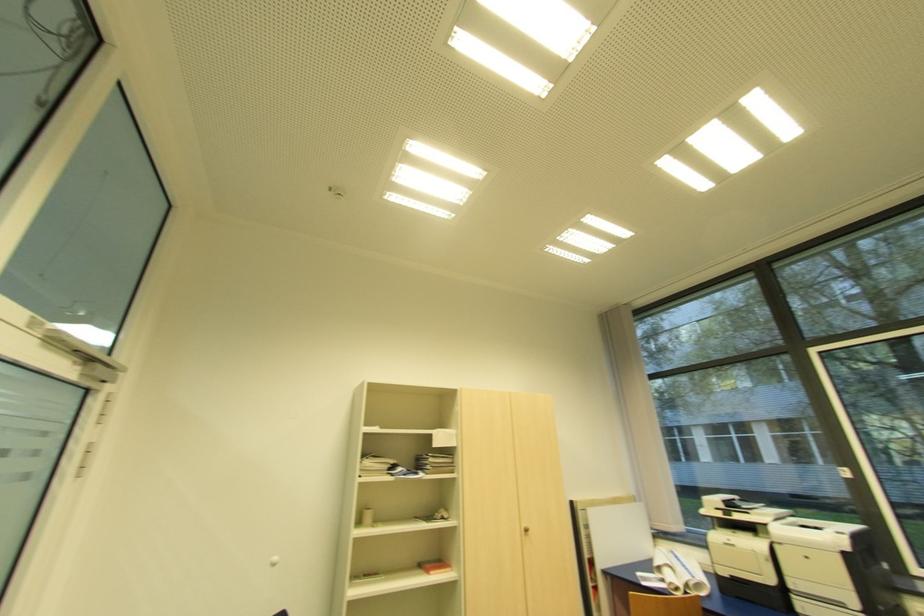
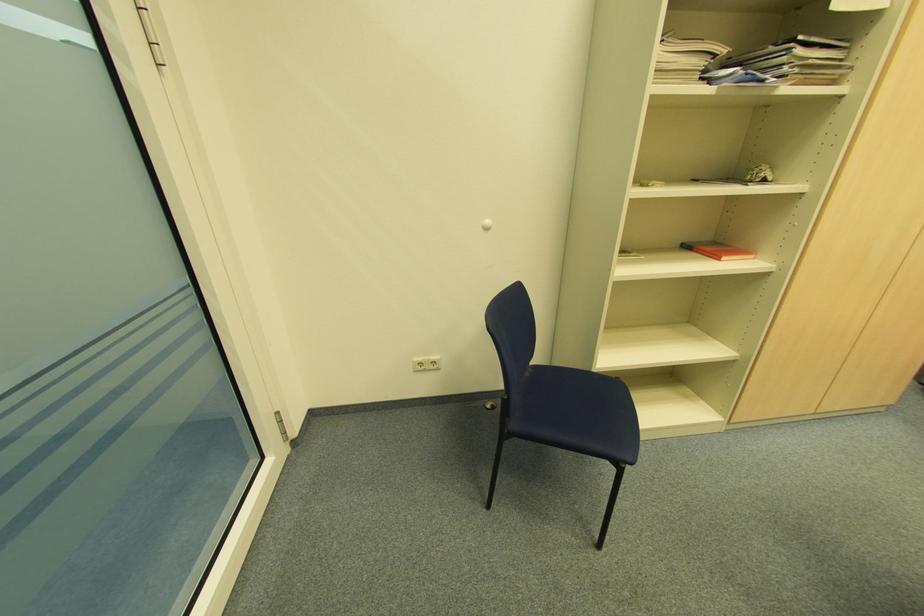
Find the pixel in the second image that matches pixel 432 573 in the first image.

(726, 257)